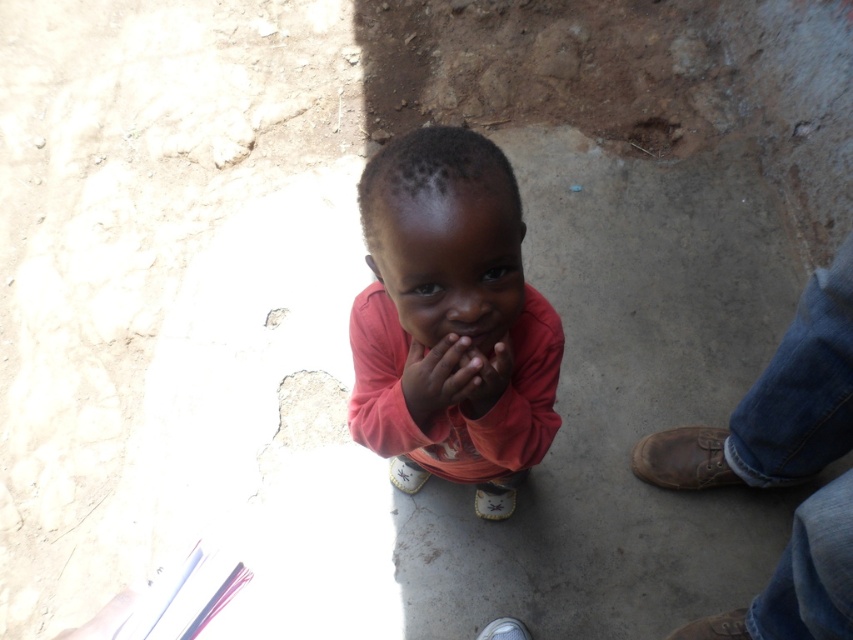
You are a tailor measuring the distance between the matte pink shirt at center and the matte skin hand at center for a custom fit. The minimum required space for proper movement is 6 inches. Can the current distance accommodate this requirement?

The distance between the matte pink shirt at center and the matte skin hand at center is 6.40 inches, which exceeds the 6 inches minimum requirement. Therefore, the current distance can accommodate the required space for proper movement.

You are a photographer taking a portrait of the child. The camera is set to focus on objects 1 meter away. Will the matte skin hand at center be in focus?

The matte skin hand at center is 1.06 meters away from the camera, which is slightly beyond the 1 meter focus setting. Therefore, the hand may not be in perfect focus.

The child in the scene has two hands visible. Which hand, the matte skin hand at center or the smooth skin hand at center, is located to the left?

The matte skin hand at center is positioned on the left side of the smooth skin hand at center, so the matte skin hand at center is the one located to the left.